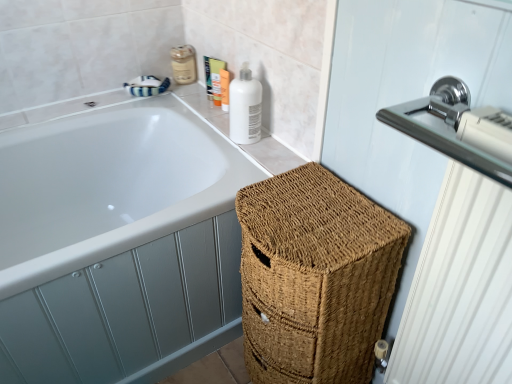
Question: Can you confirm if matte beige lotion at upper center, the fourth toiletry positioned from the right, is wider than polished chrome radiator at upper right?

Choices:
 (A) no
 (B) yes

Answer: (A)

Question: Is matte beige lotion at upper center, the 1th toiletry when ordered from left to right, smaller than polished chrome radiator at upper right?

Choices:
 (A) no
 (B) yes

Answer: (B)

Question: Does matte beige lotion at upper center, the fourth toiletry positioned from the right, appear on the right side of polished chrome radiator at upper right?

Choices:
 (A) no
 (B) yes

Answer: (A)

Question: Is matte beige lotion at upper center, the 1th toiletry when ordered from left to right, taller than polished chrome radiator at upper right?

Choices:
 (A) no
 (B) yes

Answer: (A)

Question: Can you confirm if matte beige lotion at upper center, the 1th toiletry when ordered from left to right, is bigger than polished chrome radiator at upper right?

Choices:
 (A) yes
 (B) no

Answer: (B)

Question: Is matte beige lotion at upper center, the 1th toiletry when ordered from left to right, thinner than polished chrome radiator at upper right?

Choices:
 (A) no
 (B) yes

Answer: (B)

Question: Is matte orange tube at upper center, which is the 2th toiletry in right-to-left order, oriented towards white glossy bottle at upper right?

Choices:
 (A) yes
 (B) no

Answer: (B)

Question: Is matte orange tube at upper center, which is the 2th toiletry in right-to-left order, bigger than white glossy bottle at upper right?

Choices:
 (A) yes
 (B) no

Answer: (B)

Question: Is the depth of matte orange tube at upper center, the third toiletry positioned from the left, less than that of white glossy bottle at upper right?

Choices:
 (A) yes
 (B) no

Answer: (B)

Question: Does matte orange tube at upper center, the third toiletry positioned from the left, appear on the left side of white glossy bottle at upper right?

Choices:
 (A) no
 (B) yes

Answer: (B)

Question: Is matte orange tube at upper center, which is the 2th toiletry in right-to-left order, completely or partially outside of white glossy bottle at upper right?

Choices:
 (A) no
 (B) yes

Answer: (B)

Question: Can you confirm if matte orange tube at upper center, which is the 2th toiletry in right-to-left order, is wider than white glossy bottle at upper right?

Choices:
 (A) yes
 (B) no

Answer: (B)

Question: Does white glossy bottle at upper right have a lesser width compared to matte white lotion at upper right, arranged as the 4th toiletry when viewed from the left?

Choices:
 (A) no
 (B) yes

Answer: (A)